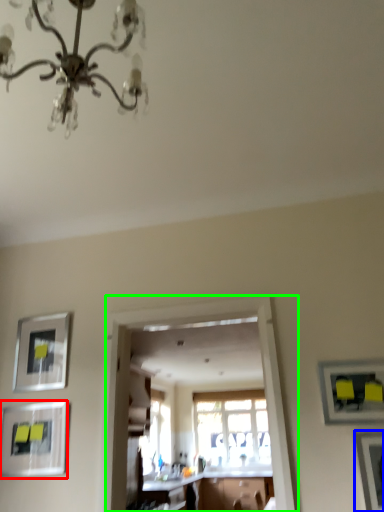
Question: Considering the real-world distances, which object is closest to picture frame (highlighted by a red box)? picture frame (highlighted by a blue box) or glass door (highlighted by a green box).

Choices:
 (A) picture frame
 (B) glass door

Answer: (B)